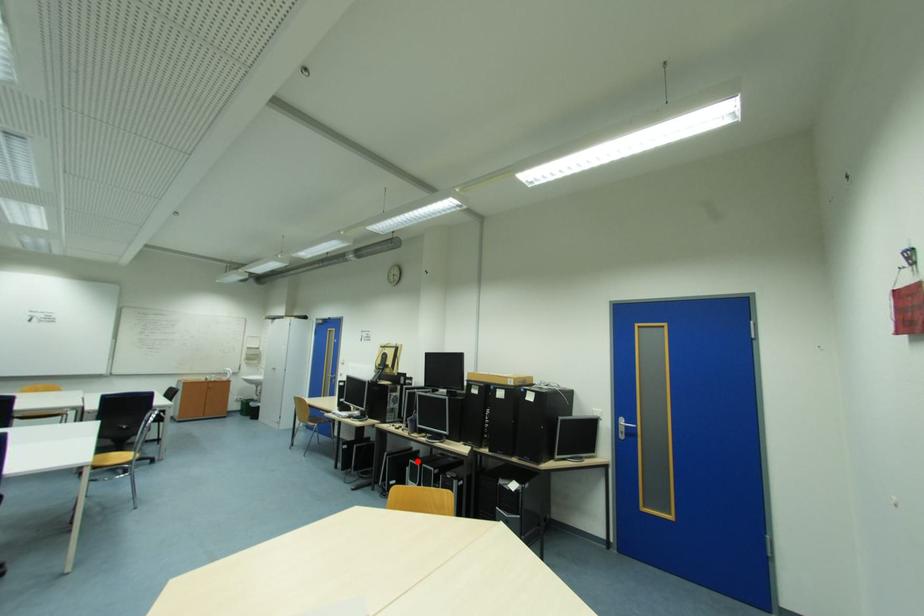
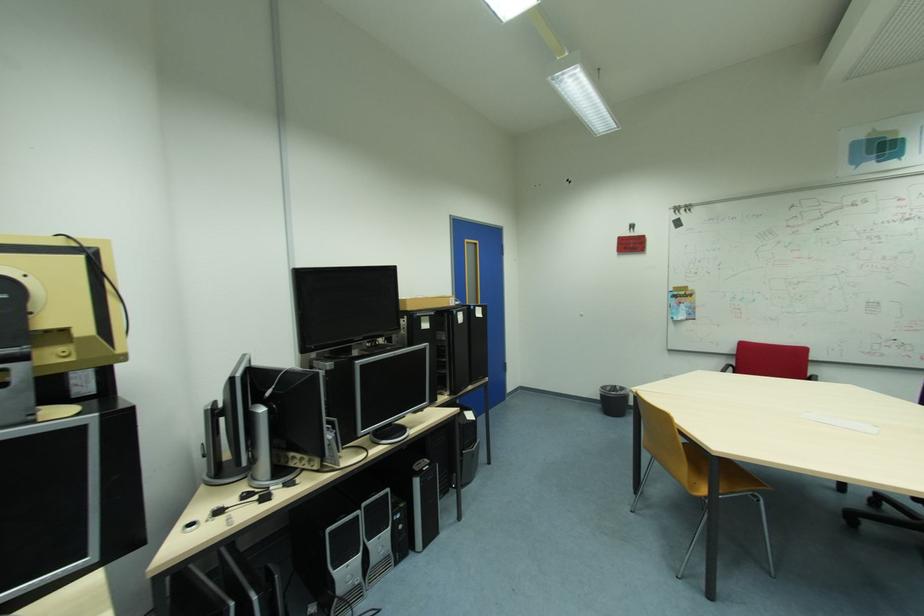
In the second image, find the point that corresponds to the highlighted location in the first image.

(335, 530)